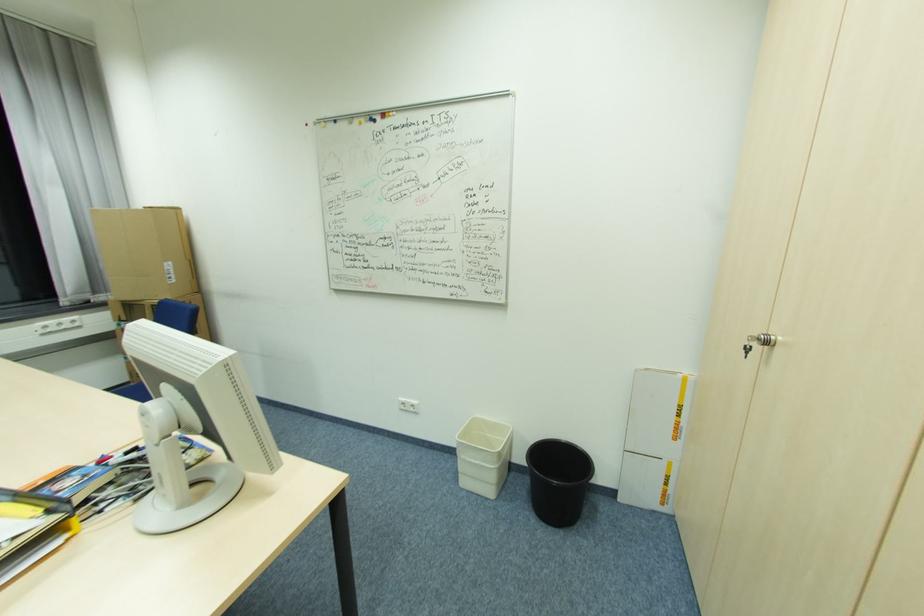
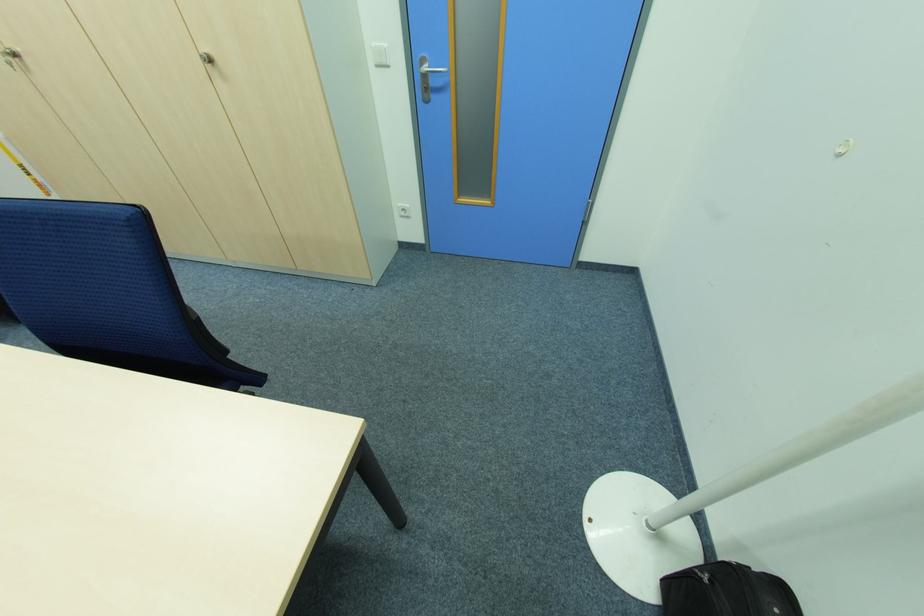
The point at (772, 344) is marked in the first image. Where is the corresponding point in the second image?

(18, 55)